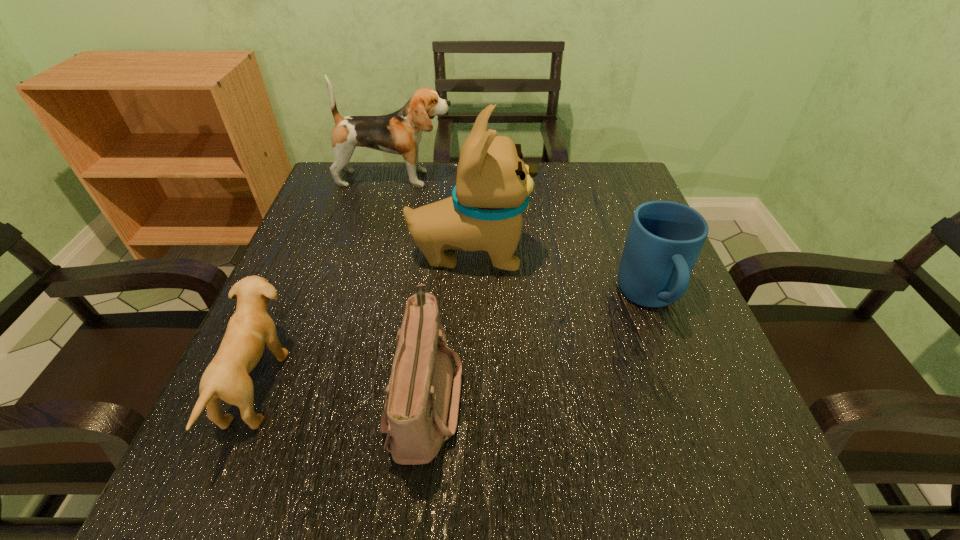
You are a GUI agent. You are given a task and a screenshot of the screen. Output one action in this format:
    pyautogui.click(x=<x>, y=<y>)
    Task: Click on the unoccupied position between the rightmost object and the second tallest object
    
    Given the screenshot: What is the action you would take?
    pyautogui.click(x=523, y=238)

In order to click on free space that is in between the rightmost object and the farthest object in this screenshot , I will do `click(523, 238)`.

The width and height of the screenshot is (960, 540). I want to click on free spot between the mug and the second farthest puppy, so click(560, 276).

Point out which object is positioned as the third nearest to the rightmost object. Please provide its 2D coordinates. Your answer should be formatted as a tuple, i.e. [(x, y)], where the tuple contains the x and y coordinates of a point satisfying the conditions above.

[(400, 133)]

Where is `the second closest object to the second tallest object`? the second closest object to the second tallest object is located at coordinates [x=250, y=328].

In order to click on puppy that stands as the third closest to the shoulder bag in this screenshot , I will do `click(400, 133)`.

Choose which puppy is the nearest neighbor to the farthest puppy. Please provide its 2D coordinates. Your answer should be formatted as a tuple, i.e. [(x, y)], where the tuple contains the x and y coordinates of a point satisfying the conditions above.

[(493, 185)]

This screenshot has width=960, height=540. In order to click on free location that satisfies the following two spatial constraints: 1. on the side of the rightmost object with the handle; 2. on the left side of the shortest puppy in this screenshot , I will do `click(684, 386)`.

This screenshot has height=540, width=960. In order to click on vacant region that satisfies the following two spatial constraints: 1. on the side of the rightmost object with the handle; 2. on the front pocket of the shoulder bag in this screenshot , I will do `click(687, 397)`.

This screenshot has height=540, width=960. What are the coordinates of `free spot that satisfies the following two spatial constraints: 1. on the side of the mug with the handle; 2. on the left side of the shortest puppy` in the screenshot? It's located at (684, 386).